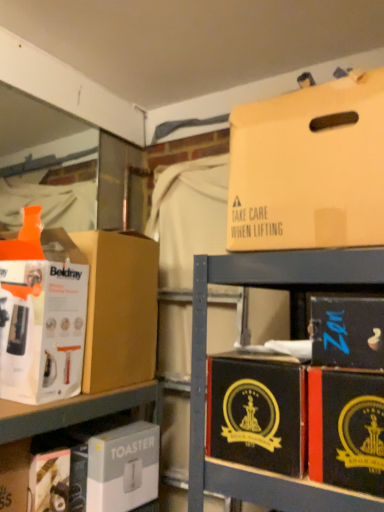
Question: Does white cardboard box at left, which ranks as the sixth box in bottom-to-top order, have a lesser height compared to black cardboard box at lower right, which ranks as the 5th box in bottom-to-top order?

Choices:
 (A) no
 (B) yes

Answer: (A)

Question: Does white cardboard box at left, which is counted as the second box, starting from the top, have a smaller size compared to black cardboard box at lower right, which ranks as the 5th box in bottom-to-top order?

Choices:
 (A) no
 (B) yes

Answer: (A)

Question: Considering the relative sizes of white cardboard box at left, which is counted as the second box, starting from the top, and black cardboard box at lower right, which ranks as the 5th box in bottom-to-top order, in the image provided, is white cardboard box at left, which is counted as the second box, starting from the top, thinner than black cardboard box at lower right, which ranks as the 5th box in bottom-to-top order,?

Choices:
 (A) yes
 (B) no

Answer: (B)

Question: Is white cardboard box at left, which ranks as the sixth box in bottom-to-top order, wider than black cardboard box at lower right, which ranks as the 5th box in bottom-to-top order?

Choices:
 (A) yes
 (B) no

Answer: (A)

Question: Could you tell me if white cardboard box at left, which is counted as the second box, starting from the top, is facing black cardboard box at lower right, which is the third box from top to bottom?

Choices:
 (A) no
 (B) yes

Answer: (B)

Question: Is beige cardboard box at upper right, the 1th box viewed from the top, to the left or to the right of white cardboard toaster at lower center, the 1th box ordered from the bottom, in the image?

Choices:
 (A) right
 (B) left

Answer: (A)

Question: Is point (311, 180) positioned closer to the camera than point (107, 506)?

Choices:
 (A) farther
 (B) closer

Answer: (B)

Question: From the image's perspective, is beige cardboard box at upper right, which is counted as the 7th box, starting from the bottom, positioned above or below white cardboard toaster at lower center, the 7th box viewed from the top?

Choices:
 (A) above
 (B) below

Answer: (A)

Question: Is beige cardboard box at upper right, the 1th box viewed from the top, inside or outside of white cardboard toaster at lower center, the 7th box viewed from the top?

Choices:
 (A) outside
 (B) inside

Answer: (A)

Question: From the image's perspective, is black cardboard box at lower right, arranged as the fifth box when viewed from the top, positioned above or below matte cardboard box at left, acting as the 4th box starting from the bottom?

Choices:
 (A) above
 (B) below

Answer: (B)

Question: Considering the positions of black cardboard box at lower right, arranged as the fifth box when viewed from the top, and matte cardboard box at left, acting as the 4th box starting from the bottom, in the image, is black cardboard box at lower right, arranged as the fifth box when viewed from the top, taller or shorter than matte cardboard box at left, acting as the 4th box starting from the bottom,?

Choices:
 (A) short
 (B) tall

Answer: (A)

Question: From a real-world perspective, is black cardboard box at lower right, placed as the third box when sorted from bottom to top, above or below matte cardboard box at left, acting as the 4th box starting from the bottom?

Choices:
 (A) above
 (B) below

Answer: (B)

Question: Is point (307, 445) closer or farther from the camera than point (120, 242)?

Choices:
 (A) closer
 (B) farther

Answer: (A)

Question: Considering the positions of white cardboard toaster at lower center, the 7th box viewed from the top, and black cardboard box at center right, the second box in the bottom-to-top sequence, in the image, is white cardboard toaster at lower center, the 7th box viewed from the top, wider or thinner than black cardboard box at center right, the second box in the bottom-to-top sequence,?

Choices:
 (A) thin
 (B) wide

Answer: (A)

Question: Is white cardboard toaster at lower center, the 7th box viewed from the top, to the left or to the right of black cardboard box at center right, acting as the sixth box starting from the top, in the image?

Choices:
 (A) right
 (B) left

Answer: (B)